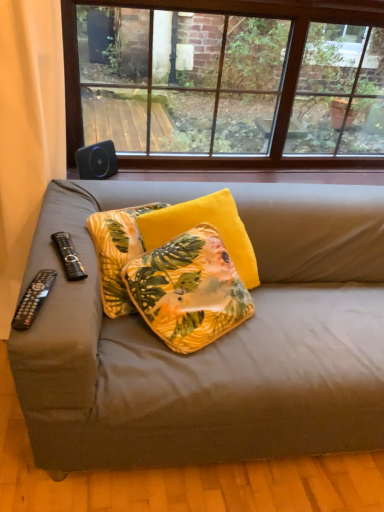
Question: Is yellow velvet pillow at center, positioned as the 1th pillow in left-to-right order, at the right side of yellow floral pillow at center, positioned as the 2th pillow in right-to-left order?

Choices:
 (A) yes
 (B) no

Answer: (B)

Question: Can you confirm if yellow velvet pillow at center, the third pillow from the right, is wider than yellow floral pillow at center, the 2th pillow in the left-to-right sequence?

Choices:
 (A) yes
 (B) no

Answer: (B)

Question: From the image's perspective, is yellow velvet pillow at center, the third pillow from the right, located beneath yellow floral pillow at center, positioned as the 2th pillow in right-to-left order?

Choices:
 (A) yes
 (B) no

Answer: (B)

Question: Is yellow velvet pillow at center, the third pillow from the right, not close to yellow floral pillow at center, positioned as the 2th pillow in right-to-left order?

Choices:
 (A) yes
 (B) no

Answer: (B)

Question: From a real-world perspective, does yellow velvet pillow at center, positioned as the 1th pillow in left-to-right order, sit lower than yellow floral pillow at center, positioned as the 2th pillow in right-to-left order?

Choices:
 (A) no
 (B) yes

Answer: (B)

Question: Is yellow floral pillow at center, positioned as the 2th pillow in right-to-left order, surrounded by yellow velvet pillow at center, the third pillow from the right?

Choices:
 (A) no
 (B) yes

Answer: (A)

Question: Is black fabric remote at left closer to camera compared to yellow floral pillow at center, the 2th pillow in the left-to-right sequence?

Choices:
 (A) no
 (B) yes

Answer: (B)

Question: From a real-world perspective, is black fabric remote at left below yellow floral pillow at center, positioned as the 2th pillow in right-to-left order?

Choices:
 (A) no
 (B) yes

Answer: (A)

Question: Is black fabric remote at left at the right side of yellow floral pillow at center, the 2th pillow in the left-to-right sequence?

Choices:
 (A) yes
 (B) no

Answer: (B)

Question: Is black fabric remote at left surrounding yellow floral pillow at center, positioned as the 2th pillow in right-to-left order?

Choices:
 (A) no
 (B) yes

Answer: (A)

Question: Is black fabric remote at left at the left side of yellow floral pillow at center, the 2th pillow in the left-to-right sequence?

Choices:
 (A) no
 (B) yes

Answer: (B)

Question: Could you tell me if black fabric remote at left is turned towards yellow floral pillow at center, positioned as the 2th pillow in right-to-left order?

Choices:
 (A) no
 (B) yes

Answer: (A)

Question: Could you tell me if black plastic remote at left, which ranks as the second remote control in front-to-back order, is facing yellow velvet pillow at center, the third pillow from the right?

Choices:
 (A) yes
 (B) no

Answer: (B)